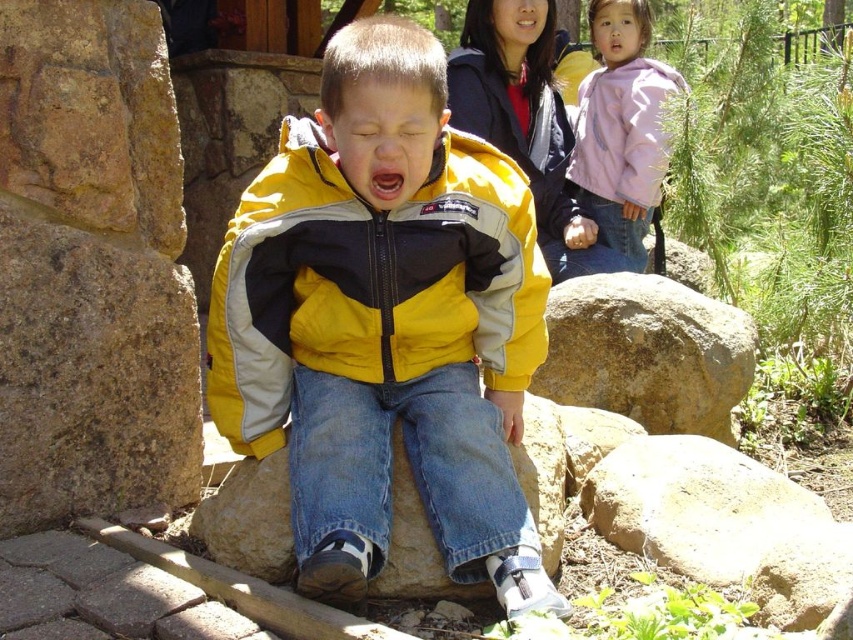
You are standing at the center of the image. Which direction should you walk to reach the rocky brown boulder at right?

You should walk to the right to reach the rocky brown boulder at right since it is located at the right side of the image.

You are a photographer adjusting your camera settings to focus on two points in the scene. The first point is point (511, 605) and the second is point (618, 4). Which point should you focus on first if you want to capture the closest object in the image?

You should focus on point (511, 605) first because it is closer to the camera than point (618, 4).